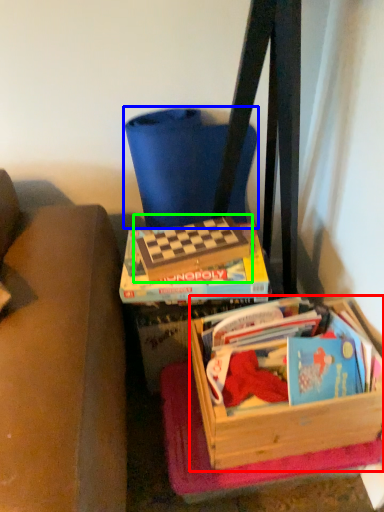
Question: Considering the real-world distances, which object is closest to box (highlighted by a red box)? folding chair (highlighted by a blue box) or paperback book (highlighted by a green box).

Choices:
 (A) folding chair
 (B) paperback book

Answer: (B)